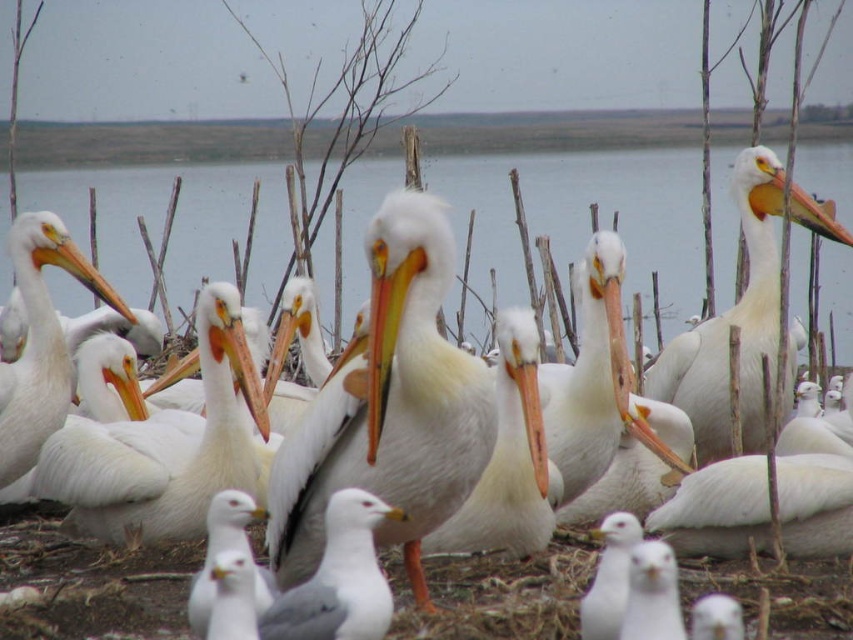
You are standing at a point where you can see the pelicans and the smaller birds. If you move forward 10 feet, will you still be able to see the point marked at coordinate point (85, 260)?

The distance between you and the point marked at coordinate point (85, 260) is 18.82 feet. If you move forward 10 feet, you will be 8.82 feet away from the point, so yes, you will still be able to see the point marked at coordinate point (85, 260).

You are a birdwatcher observing the scene. You notice the white matte pelican at left and the gray matte seagull at center. Based on their positions, which bird is higher up in the image?

The white matte pelican at left is located above the gray matte seagull at center, so it is higher up in the image.